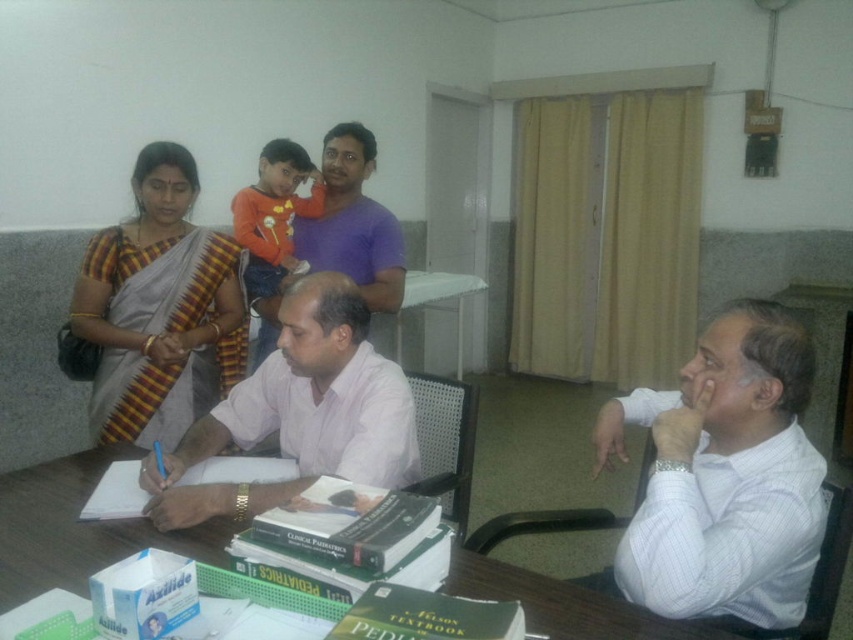
Between white striped shirt at lower right and purple cotton shirt at upper center, which one has less height?

Standing shorter between the two is white striped shirt at lower right.

Which is more to the right, white striped shirt at lower right or purple cotton shirt at upper center?

Positioned to the right is white striped shirt at lower right.

Find the location of a particular element. The width and height of the screenshot is (853, 640). white striped shirt at lower right is located at coordinates (724, 476).

Is wooden table at center behind purple cotton shirt at upper center?

No, it is in front of purple cotton shirt at upper center.

Who is taller, wooden table at center or purple cotton shirt at upper center?

Standing taller between the two is purple cotton shirt at upper center.

Which is behind, point (181, 545) or point (376, 236)?

The point (376, 236) is behind.

Locate an element on the screen. wooden table at center is located at coordinates (77, 529).

The image size is (853, 640). Identify the location of pink shirt at center. (299, 412).

Does pink shirt at center have a larger size compared to wooden table at center?

Yes.

Which is behind, point (229, 410) or point (41, 506)?

The point (229, 410) is behind.

The height and width of the screenshot is (640, 853). In order to click on pink shirt at center in this screenshot , I will do `click(299, 412)`.